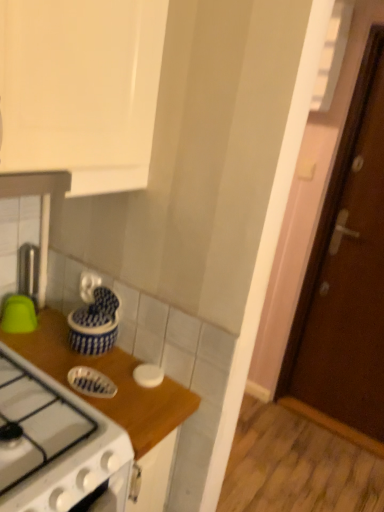
Find the location of `vacant space that is to the left of brown wooden door at right`. vacant space that is to the left of brown wooden door at right is located at coordinates (287, 430).